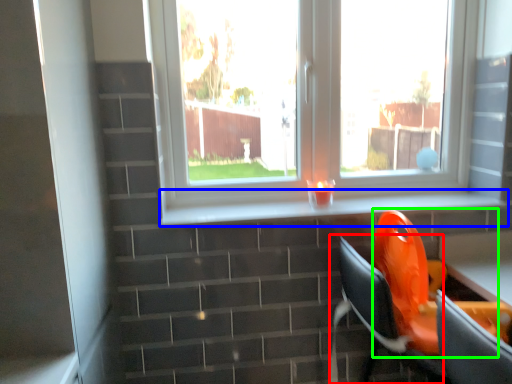
Question: Which is farther away from computer chair (highlighted by a red box)? window sill (highlighted by a blue box) or swivel chair (highlighted by a green box)?

Choices:
 (A) window sill
 (B) swivel chair

Answer: (A)